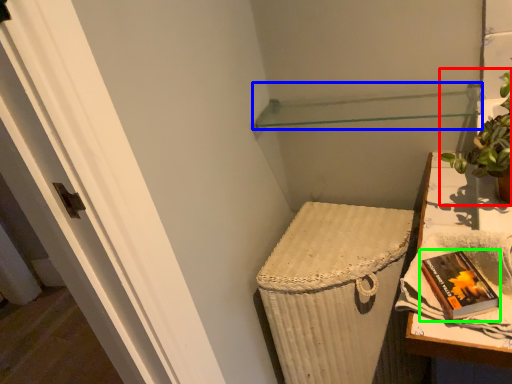
Question: Considering the real-world distances, which object is closest to houseplant (highlighted by a red box)? shelf (highlighted by a blue box) or paperback book (highlighted by a green box).

Choices:
 (A) shelf
 (B) paperback book

Answer: (B)